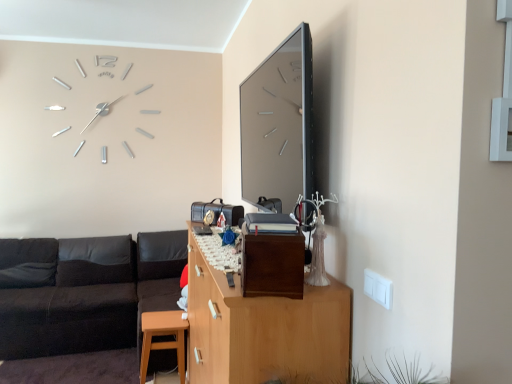
You are a GUI agent. You are given a task and a screenshot of the screen. Output one action in this format:
    pyautogui.click(x=<x>, y=<y>)
    Task: Click on the vacant space situated above brown matte/file cabinet at center (from a real-world perspective)
    Image resolution: width=512 pixels, height=384 pixels.
    Given the screenshot: What is the action you would take?
    pyautogui.click(x=270, y=224)